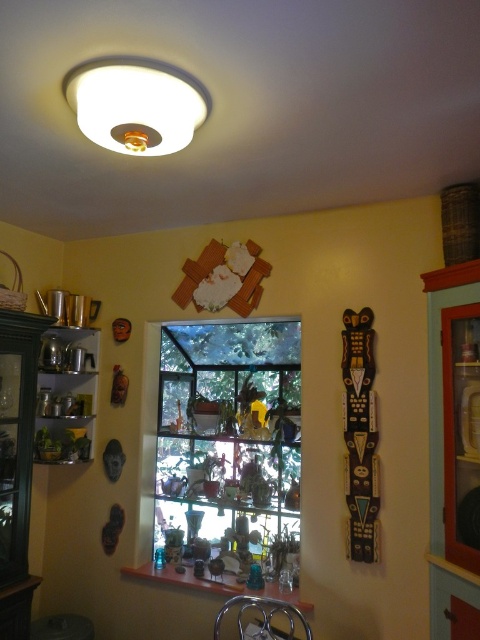
Question: Estimate the real-world distances between objects in this image. Which object is closer to the metallic shiny pots at left?

Choices:
 (A) clear glass window at center
 (B) white matte light fixture at upper center

Answer: (A)

Question: Does clear glass window at center have a lesser width compared to white matte light fixture at upper center?

Choices:
 (A) no
 (B) yes

Answer: (A)

Question: Can you confirm if clear glass window at center is smaller than metallic shiny pots at left?

Choices:
 (A) no
 (B) yes

Answer: (A)

Question: Can you confirm if white matte light fixture at upper center is wider than metallic shiny pots at left?

Choices:
 (A) yes
 (B) no

Answer: (A)

Question: Which of the following is the closest to the observer?

Choices:
 (A) (132, 77)
 (B) (158, 433)
 (C) (80, 369)

Answer: (A)

Question: Which object is closer to the camera taking this photo?

Choices:
 (A) white matte light fixture at upper center
 (B) metallic shiny pots at left

Answer: (A)